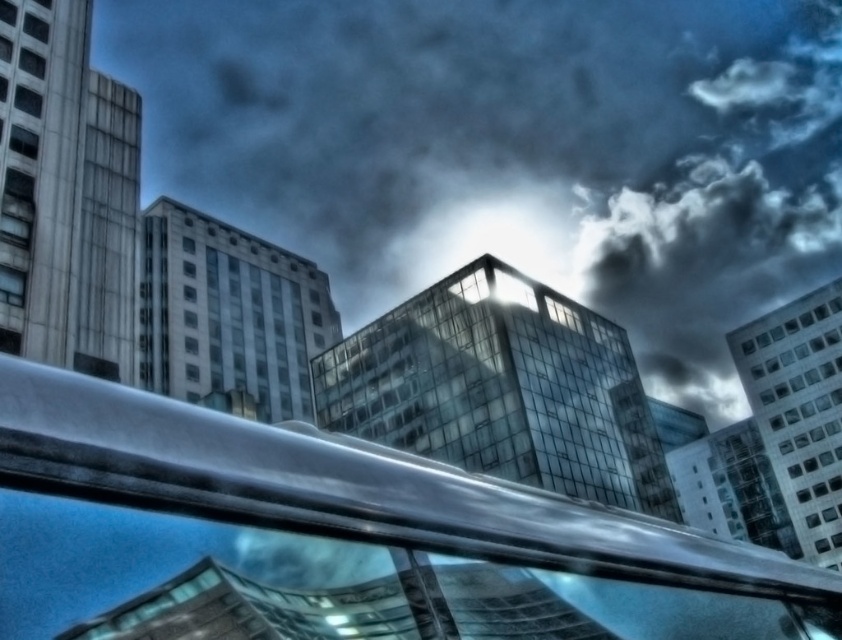
Looking at this image, who is positioned more to the right, transparent glass building at center or metallic silver railing at center?

transparent glass building at center

Which is behind, point (467, 99) or point (44, 556)?

Positioned behind is point (467, 99).

The height and width of the screenshot is (640, 842). I want to click on transparent glass building at center, so click(x=512, y=150).